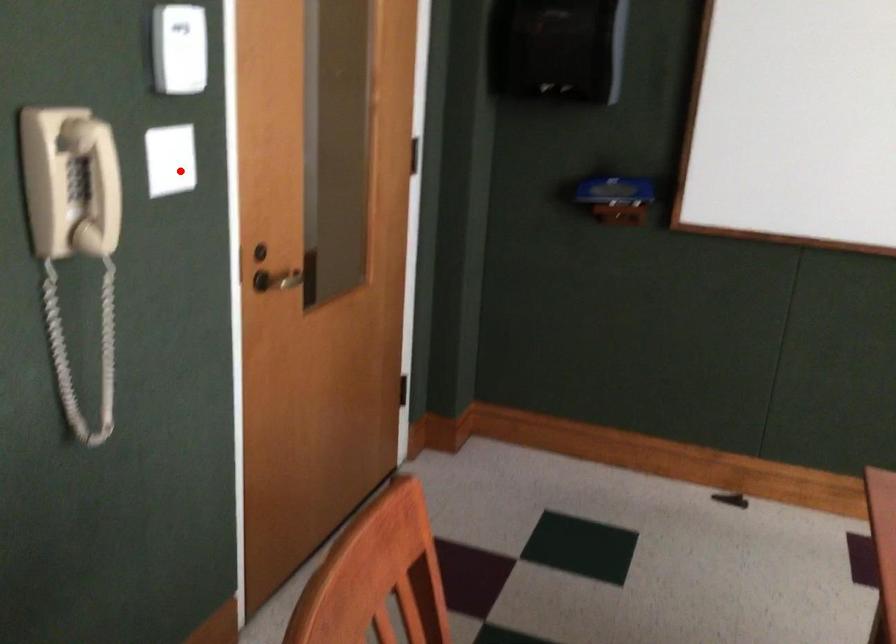
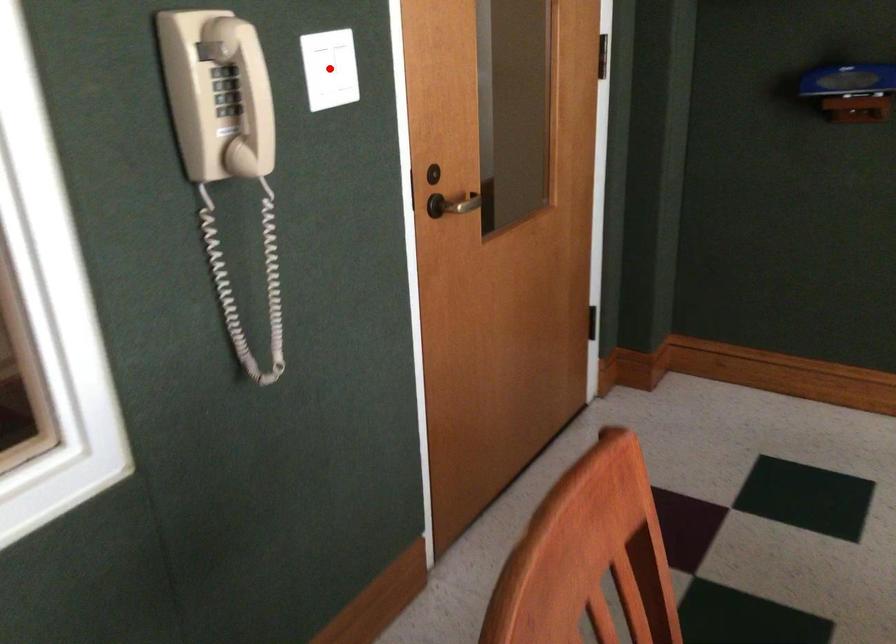
Based on the photo, I am providing you with two images of the same scene from different viewpoints. A red point is marked on the first image and another point is marked on the second image. Is the red point in image1 aligned with the point shown in image2?

Yes